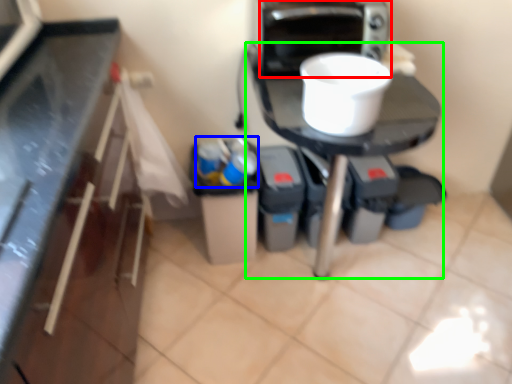
Question: Based on their relative distances, which object is nearer to home appliance (highlighted by a red box)? Choose from garbage (highlighted by a blue box) and table (highlighted by a green box).

Choices:
 (A) garbage
 (B) table

Answer: (B)